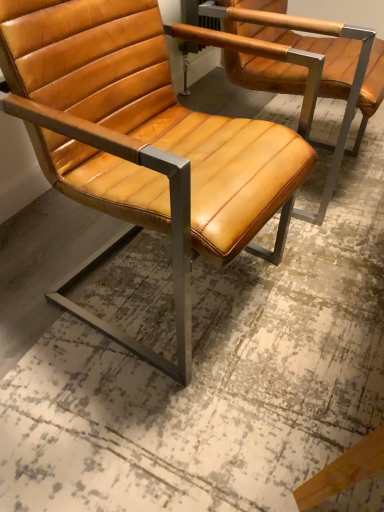
Where is `free space in front of matte leather chair at center`? The height and width of the screenshot is (512, 384). free space in front of matte leather chair at center is located at coordinates (167, 421).